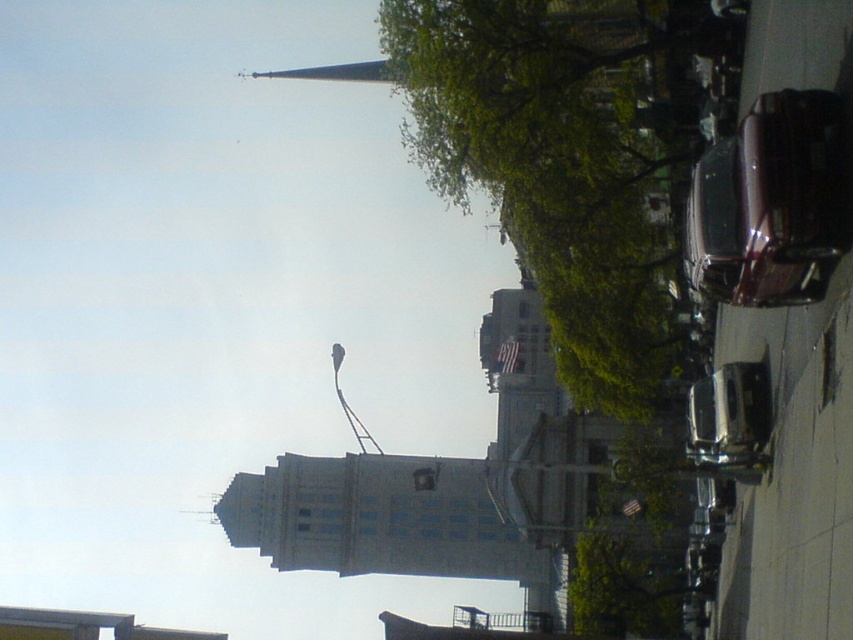
Question: Can you confirm if green leafy tree at upper center is positioned above shiny maroon car at right?

Choices:
 (A) no
 (B) yes

Answer: (B)

Question: Estimate the real-world distances between objects in this image. Which object is farther from the shiny silver sedan at center?

Choices:
 (A) green leafy tree at upper center
 (B) shiny maroon car at right

Answer: (A)

Question: Which is farther from the shiny silver sedan at center?

Choices:
 (A) shiny maroon car at right
 (B) green leafy tree at upper center

Answer: (B)

Question: Does green leafy tree at upper center appear under shiny silver sedan at center?

Choices:
 (A) yes
 (B) no

Answer: (B)

Question: Observing the image, what is the correct spatial positioning of shiny maroon car at right in reference to shiny silver sedan at center?

Choices:
 (A) right
 (B) left

Answer: (B)

Question: Which point appears closest to the camera in this image?

Choices:
 (A) (726, 460)
 (B) (465, 205)
 (C) (709, 180)

Answer: (C)